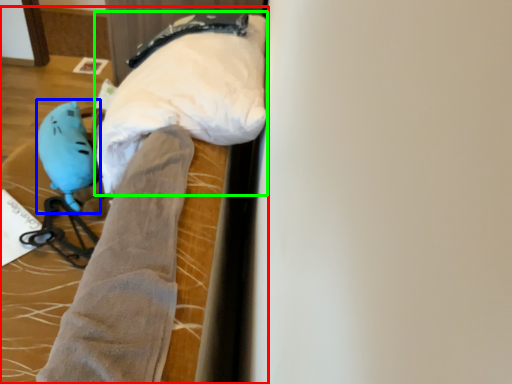
Question: Considering the real-world distances, which object is closest to bed (highlighted by a red box)? toy (highlighted by a blue box) or wide (highlighted by a green box).

Choices:
 (A) toy
 (B) wide

Answer: (A)